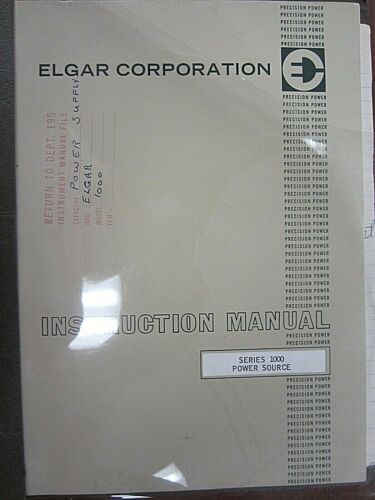
At what (x,y) coordinates should I click in order to perform the action: click on wood table. Please return your answer as a coordinate pair (x, y). Looking at the image, I should click on (358, 489), (319, 493), (254, 495), (370, 13).